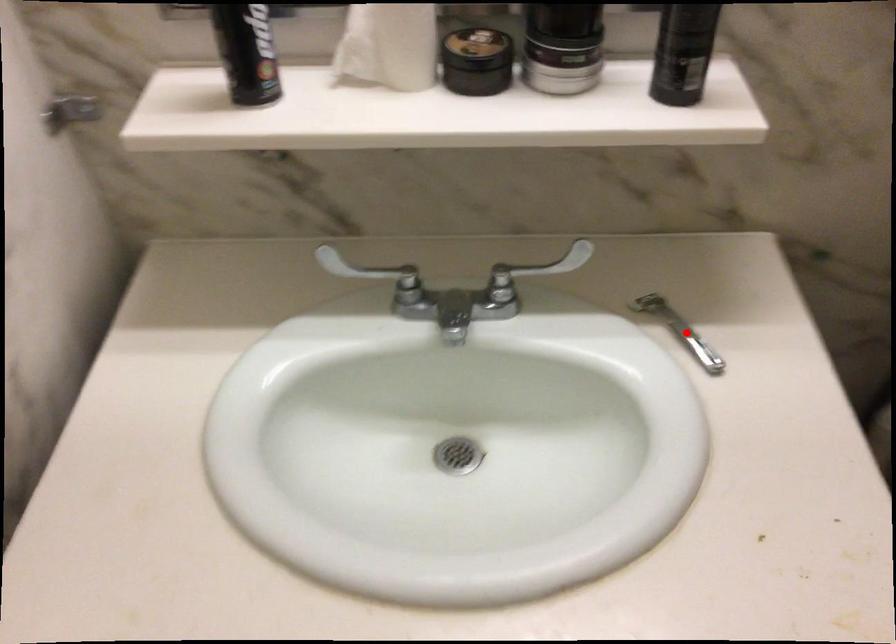
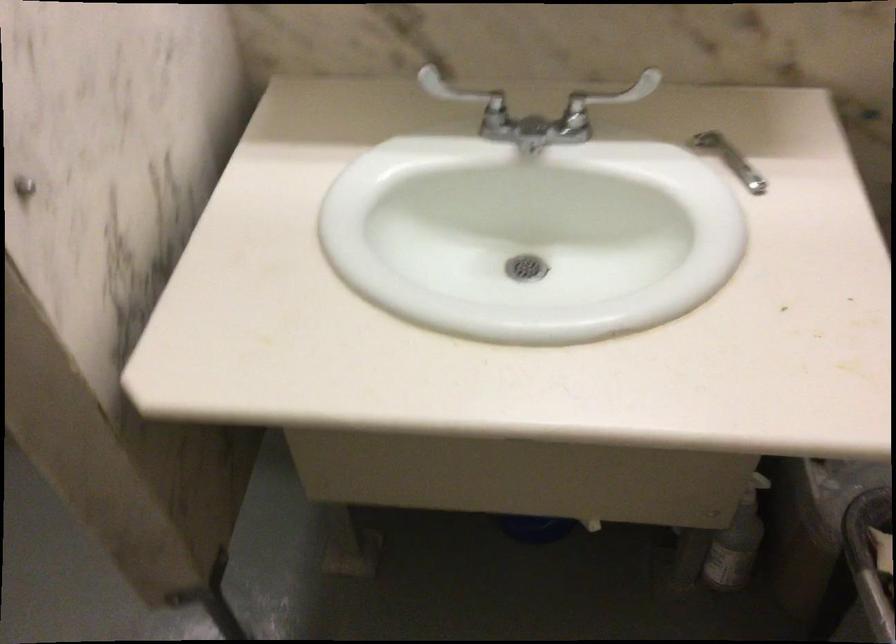
Find the pixel in the second image that matches the highlighted location in the first image.

(729, 158)